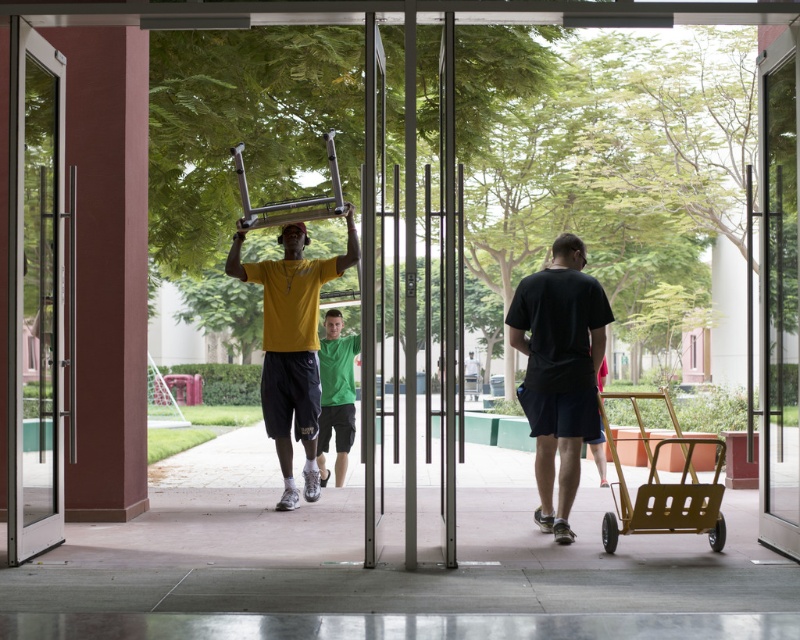
Can you confirm if transparent glass screen door at center is taller than gold metallic cart at lower right?

Correct, transparent glass screen door at center is much taller as gold metallic cart at lower right.

Can you confirm if transparent glass screen door at center is smaller than gold metallic cart at lower right?

Correct, transparent glass screen door at center occupies less space than gold metallic cart at lower right.

Locate an element on the screen. This screenshot has height=640, width=800. transparent glass screen door at center is located at coordinates (780, 296).

Where is `transparent glass screen door at center`? transparent glass screen door at center is located at coordinates (780, 296).

Does transparent glass screen door at left have a larger size compared to transparent glass door at center?

No, transparent glass screen door at left is not bigger than transparent glass door at center.

Does transparent glass screen door at left come behind transparent glass door at center?

That is True.

Between point (40, 81) and point (440, 102), which one is positioned behind?

The point (440, 102) is more distant.

Where is `transparent glass screen door at left`? This screenshot has width=800, height=640. transparent glass screen door at left is located at coordinates click(x=34, y=292).

Looking at this image, who is positioned more to the left, yellow matte t-shirt at center or green matte shirt at center?

yellow matte t-shirt at center

Between point (318, 369) and point (325, 428), which one is positioned behind?

The point (325, 428) is behind.

Who is more distant from viewer, (346, 256) or (329, 353)?

Point (329, 353)

The width and height of the screenshot is (800, 640). I want to click on yellow matte t-shirt at center, so click(292, 349).